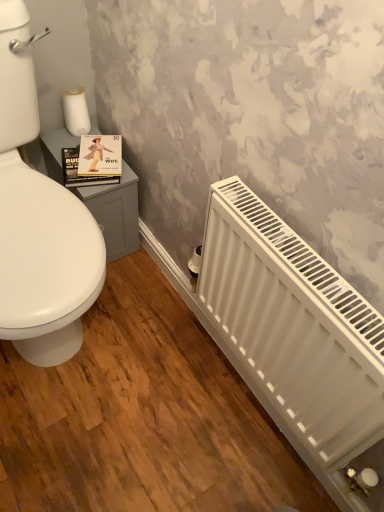
Question: From the image's perspective, is white matte toilet paper at upper left below white matte radiator at lower right?

Choices:
 (A) no
 (B) yes

Answer: (A)

Question: Can you confirm if white matte toilet paper at upper left is wider than white matte radiator at lower right?

Choices:
 (A) yes
 (B) no

Answer: (A)

Question: Considering the relative sizes of white matte toilet paper at upper left and white matte radiator at lower right in the image provided, is white matte toilet paper at upper left shorter than white matte radiator at lower right?

Choices:
 (A) yes
 (B) no

Answer: (A)

Question: Is white matte toilet paper at upper left far from white matte radiator at lower right?

Choices:
 (A) no
 (B) yes

Answer: (A)

Question: Does white matte toilet paper at upper left have a greater height compared to white matte radiator at lower right?

Choices:
 (A) yes
 (B) no

Answer: (B)

Question: Is point (359, 409) closer or farther from the camera than point (79, 106)?

Choices:
 (A) farther
 (B) closer

Answer: (B)

Question: From a real-world perspective, is white matte radiator at lower right physically located above or below white matte toilet paper at upper left?

Choices:
 (A) above
 (B) below

Answer: (B)

Question: Considering the relative positions of white matte radiator at lower right and white matte toilet paper at upper left in the image provided, is white matte radiator at lower right to the left or to the right of white matte toilet paper at upper left?

Choices:
 (A) right
 (B) left

Answer: (A)

Question: In terms of height, does white matte radiator at lower right look taller or shorter compared to white matte toilet paper at upper left?

Choices:
 (A) short
 (B) tall

Answer: (B)

Question: Considering the positions of point (72, 104) and point (109, 140), is point (72, 104) closer or farther from the camera than point (109, 140)?

Choices:
 (A) farther
 (B) closer

Answer: (A)

Question: Is white matte toilet paper at upper left inside the boundaries of matte paper book at upper left, or outside?

Choices:
 (A) outside
 (B) inside

Answer: (A)

Question: Considering the positions of white matte toilet paper at upper left and matte paper book at upper left in the image, is white matte toilet paper at upper left wider or thinner than matte paper book at upper left?

Choices:
 (A) wide
 (B) thin

Answer: (B)

Question: From the image's perspective, is white matte toilet paper at upper left above or below matte paper book at upper left?

Choices:
 (A) above
 (B) below

Answer: (A)

Question: Would you say matte paper book at upper left is to the left or to the right of white matte toilet paper at upper left in the picture?

Choices:
 (A) left
 (B) right

Answer: (B)

Question: Considering the positions of matte paper book at upper left and white matte toilet paper at upper left in the image, is matte paper book at upper left taller or shorter than white matte toilet paper at upper left?

Choices:
 (A) tall
 (B) short

Answer: (B)